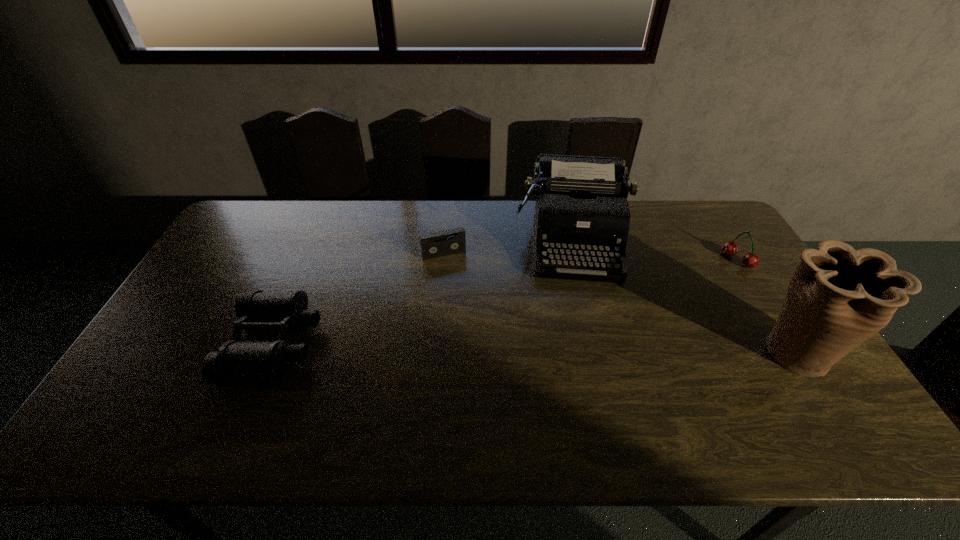
Locate an element on the screen. The image size is (960, 540). free region located on the front-facing side of the fourth object from right to left is located at coordinates (461, 289).

Find the location of a particular element. The height and width of the screenshot is (540, 960). vacant area situated 0.200m with stems pointing upwards on the cherry is located at coordinates (691, 293).

In order to click on free space located 0.390m with stems pointing upwards on the cherry in this screenshot , I will do `click(649, 321)`.

Locate an element on the screen. The image size is (960, 540). free space located 0.300m with stems pointing upwards on the cherry is located at coordinates (669, 307).

At what (x,y) coordinates should I click in order to perform the action: click on vacant space located on the typing side of the third object from right to left. Please return your answer as a coordinate pair (x, y). The image size is (960, 540). Looking at the image, I should click on click(x=578, y=310).

The image size is (960, 540). What are the coordinates of `free spot located 0.240m on the typing side of the third object from right to left` in the screenshot? It's located at (582, 349).

At what (x,y) coordinates should I click in order to perform the action: click on vacant space located 0.110m on the typing side of the third object from right to left. Please return your answer as a coordinate pair (x, y). This screenshot has width=960, height=540. Looking at the image, I should click on (578, 313).

Where is `object situated at the far edge`? object situated at the far edge is located at coordinates (581, 211).

Identify the location of binoculars that is at the near edge. This screenshot has width=960, height=540. (238, 362).

Locate an element on the screen. The height and width of the screenshot is (540, 960). urn located at the near edge is located at coordinates (838, 297).